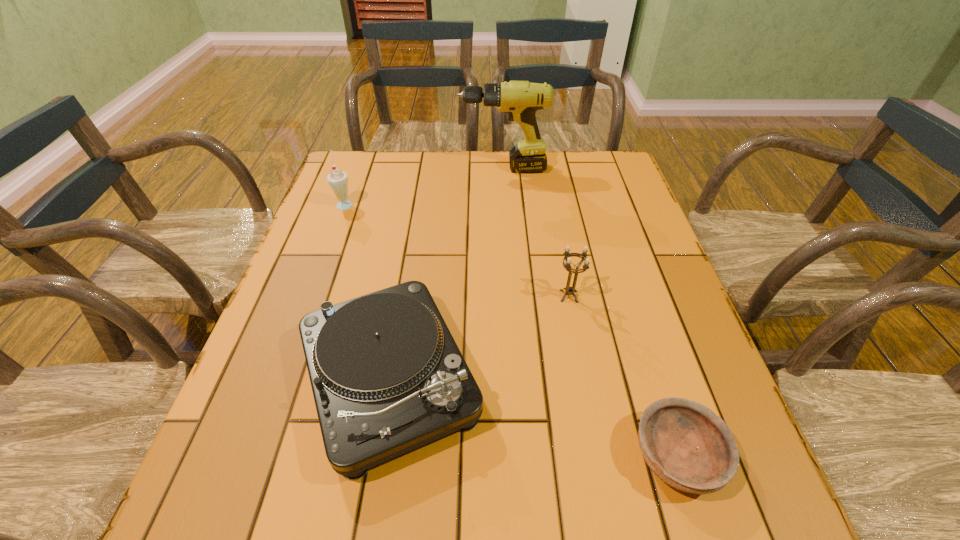
The image size is (960, 540). What are the coordinates of `free location that satisfies the following two spatial constraints: 1. on the straw side of the candle holder; 2. on the left side of the fourth nearest object` in the screenshot? It's located at (311, 296).

Find the location of `free space that satisfies the following two spatial constraints: 1. on the back side of the second shortest object; 2. on the straw side of the leftmost object`. free space that satisfies the following two spatial constraints: 1. on the back side of the second shortest object; 2. on the straw side of the leftmost object is located at coordinates (419, 204).

Find the location of `free space that satisfies the following two spatial constraints: 1. on the straw side of the second shortest object; 2. on the right side of the fourth nearest object`. free space that satisfies the following two spatial constraints: 1. on the straw side of the second shortest object; 2. on the right side of the fourth nearest object is located at coordinates (281, 379).

Where is `vacant space that satisfies the following two spatial constraints: 1. on the straw side of the rightmost object; 2. on the left side of the leftmost object`? Image resolution: width=960 pixels, height=540 pixels. vacant space that satisfies the following two spatial constraints: 1. on the straw side of the rightmost object; 2. on the left side of the leftmost object is located at coordinates (252, 456).

Locate an element on the screen. vacant space that satisfies the following two spatial constraints: 1. on the straw side of the candle holder; 2. on the right side of the leftmost object is located at coordinates (311, 296).

Find the location of a particular element. free space that satisfies the following two spatial constraints: 1. on the handle side of the tallest object; 2. on the left side of the bowl is located at coordinates (523, 456).

You are a GUI agent. You are given a task and a screenshot of the screen. Output one action in this format:
    pyautogui.click(x=<x>, y=<y>)
    Task: Click on the vacant space that satisfies the following two spatial constraints: 1. on the straw side of the bowl; 2. on the left side of the milkshake
    This screenshot has width=960, height=540.
    Given the screenshot: What is the action you would take?
    pyautogui.click(x=252, y=456)

What are the coordinates of `vacant region that satisfies the following two spatial constraints: 1. on the straw side of the milkshake; 2. on the right side of the shortest object` in the screenshot? It's located at [x=252, y=456].